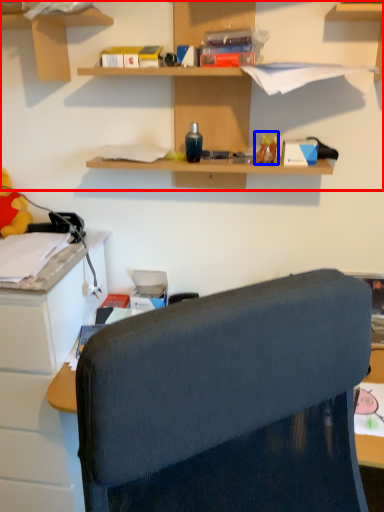
Question: Which object is closer to the camera taking this photo, shelf (highlighted by a red box) or toy (highlighted by a blue box)?

Choices:
 (A) shelf
 (B) toy

Answer: (A)